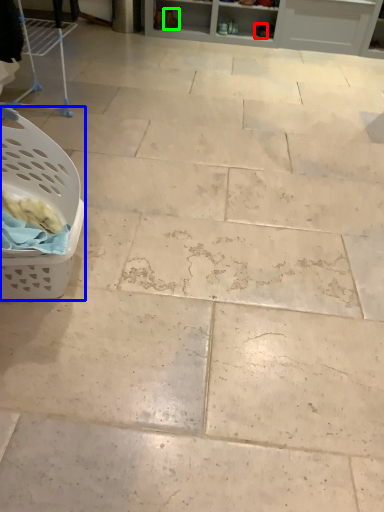
Question: Which object is positioned farthest from footwear (highlighted by a red box)? Select from basket (highlighted by a blue box) and footwear (highlighted by a green box).

Choices:
 (A) basket
 (B) footwear

Answer: (A)